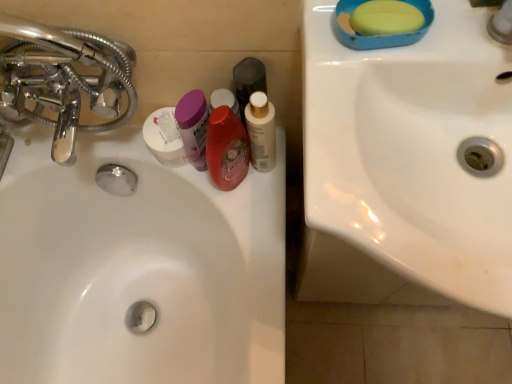
Question: In terms of height, does white glossy mouthwash at center, the 4th mouthwash when ordered from left to right, look taller or shorter compared to white glossy sink at center, placed as the 1th sink when sorted from left to right?

Choices:
 (A) tall
 (B) short

Answer: (B)

Question: Would you say white glossy mouthwash at center, the 4th mouthwash when ordered from left to right, is inside or outside white glossy sink at center, which is the 2th sink in right-to-left order?

Choices:
 (A) inside
 (B) outside

Answer: (B)

Question: Based on their relative distances, which object is farther from the black matte bottle at center, which is the 3th mouthwash in left-to-right order?

Choices:
 (A) white glossy sink at center, arranged as the second sink when viewed from the front
 (B) yellow matte soap at upper right
 (C) white matte container at center
 (D) chrome metallic faucet at left
 (E) white glossy sink at upper right, marked as the 2th sink in a back-to-front arrangement

Answer: (A)

Question: Which object is the closest to the chrome metallic faucet at left?

Choices:
 (A) white glossy sink at center, which is the 2th sink in right-to-left order
 (B) white glossy mouthwash at center, the 4th mouthwash when ordered from left to right
 (C) white matte container at center
 (D) white glossy sink at upper right, which is counted as the first sink, starting from the front
 (E) black matte bottle at center, the 2th mouthwash in the right-to-left sequence

Answer: (C)